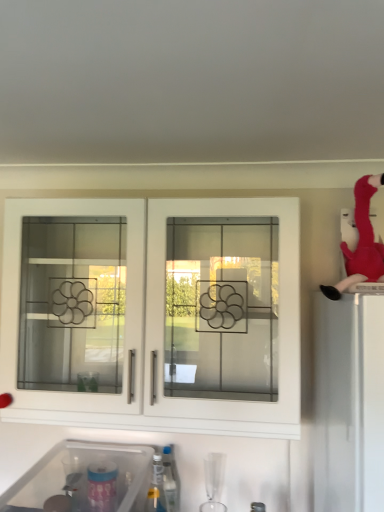
Describe the element at coordinates (156, 487) in the screenshot. I see `translucent plastic bottle at lower center` at that location.

Locate an element on the screen. Image resolution: width=384 pixels, height=512 pixels. translucent plastic bottle at lower center is located at coordinates (156, 487).

In order to face velvet plush flamingo at upper right, should I rotate leftwards or rightwards?

To face it directly, rotate right by 21.558 degrees.

Find the location of a particular element. This screenshot has width=384, height=512. transparent plastic sink at lower left is located at coordinates (83, 479).

Considering their positions, is translucent plastic bottle at lower center located in front of or behind velvet plush flamingo at upper right?

translucent plastic bottle at lower center is behind velvet plush flamingo at upper right.

Which of these two, translucent plastic bottle at lower center or velvet plush flamingo at upper right, is thinner?

translucent plastic bottle at lower center.

Do you think translucent plastic bottle at lower center is within velvet plush flamingo at upper right, or outside of it?

The correct answer is: outside.

From the image's perspective, is translucent plastic bottle at lower center located beneath velvet plush flamingo at upper right?

Yes, from the image's perspective, translucent plastic bottle at lower center is beneath velvet plush flamingo at upper right.

From a real-world perspective, which object rests below the other?

translucent plastic bottle at lower center is physically lower.

From the image's perspective, is transparent plastic sink at lower left below translucent plastic bottle at lower center?

Incorrect, from the image's perspective, transparent plastic sink at lower left is higher than translucent plastic bottle at lower center.

Where is `sink on the left of translucent plastic bottle at lower center`? This screenshot has height=512, width=384. sink on the left of translucent plastic bottle at lower center is located at coordinates (83, 479).

Is transparent plastic sink at lower left not within translucent plastic bottle at lower center?

That's correct, transparent plastic sink at lower left is outside of translucent plastic bottle at lower center.

From the image's perspective, who appears lower, transparent plastic sink at lower left or white glass cabinet doors at center?

transparent plastic sink at lower left, from the image's perspective.

Which is in front, point (24, 500) or point (224, 418)?

Positioned in front is point (224, 418).

Where is `sink that is under the white glass cabinet doors at center (from a real-world perspective)`? This screenshot has width=384, height=512. sink that is under the white glass cabinet doors at center (from a real-world perspective) is located at coordinates (83, 479).

From a real-world perspective, which is physically below, transparent plastic sink at lower left or white glass cabinet doors at center?

From a 3D spatial view, transparent plastic sink at lower left is below.

The width and height of the screenshot is (384, 512). Find the location of `person on the right of white glass cabinet doors at center`. person on the right of white glass cabinet doors at center is located at coordinates (361, 243).

How distant is velvet plush flamingo at upper right from white glass cabinet doors at center?

They are 18.03 inches apart.

Is velvet plush flamingo at upper right aimed at white glass cabinet doors at center?

No, velvet plush flamingo at upper right is not oriented towards white glass cabinet doors at center.

Which point is more forward, (147, 497) or (8, 367)?

Positioned in front is point (147, 497).

Consider the image. Can you confirm if translucent plastic bottle at lower center is smaller than white glass cabinet doors at center?

Yes, translucent plastic bottle at lower center is smaller than white glass cabinet doors at center.

Looking at this image, considering the sizes of translucent plastic bottle at lower center and white glass cabinet doors at center in the image, is translucent plastic bottle at lower center taller or shorter than white glass cabinet doors at center?

In the image, translucent plastic bottle at lower center appears to be shorter than white glass cabinet doors at center.

Is translucent plastic bottle at lower center thinner than white glass cabinet doors at center?

Indeed, translucent plastic bottle at lower center has a lesser width compared to white glass cabinet doors at center.

Between point (147, 366) and point (365, 226), which one is positioned behind?

Positioned behind is point (147, 366).

In the scene shown: Does white glass cabinet doors at center touch velvet plush flamingo at upper right?

They are not placed beside each other.

Between white glass cabinet doors at center and velvet plush flamingo at upper right, which one has smaller width?

Thinner between the two is velvet plush flamingo at upper right.

From the image's perspective, which one is positioned higher, white glass cabinet doors at center or velvet plush flamingo at upper right?

velvet plush flamingo at upper right.

Is velvet plush flamingo at upper right facing away from transparent plastic sink at lower left?

No, velvet plush flamingo at upper right is not facing the opposite direction of transparent plastic sink at lower left.

Which object is closer to the camera, velvet plush flamingo at upper right or transparent plastic sink at lower left?

transparent plastic sink at lower left is more forward.

Looking at this image, do you think velvet plush flamingo at upper right is within transparent plastic sink at lower left, or outside of it?

velvet plush flamingo at upper right lies outside transparent plastic sink at lower left.

Can you confirm if velvet plush flamingo at upper right is positioned to the right of transparent plastic sink at lower left?

Correct, you'll find velvet plush flamingo at upper right to the right of transparent plastic sink at lower left.

At what (x,y) coordinates should I click in order to perform the action: click on bottle located behind the velvet plush flamingo at upper right. Please return your answer as a coordinate pair (x, y). Looking at the image, I should click on click(156, 487).

This screenshot has width=384, height=512. In order to click on sink on the left of translucent plastic bottle at lower center in this screenshot , I will do `click(83, 479)`.

Estimate the real-world distances between objects in this image. Which object is further from transparent plastic sink at lower left, translucent plastic bottle at lower center or velvet plush flamingo at upper right?

velvet plush flamingo at upper right.

Estimate the real-world distances between objects in this image. Which object is further from transparent plastic sink at lower left, white glass cabinet doors at center or translucent plastic bottle at lower center?

The object further to transparent plastic sink at lower left is white glass cabinet doors at center.

Estimate the real-world distances between objects in this image. Which object is further from white glass cabinet doors at center, velvet plush flamingo at upper right or transparent plastic sink at lower left?

velvet plush flamingo at upper right lies further to white glass cabinet doors at center than the other object.

From the image, which object appears to be farther from velvet plush flamingo at upper right, translucent plastic bottle at lower center or transparent plastic sink at lower left?

transparent plastic sink at lower left is further to velvet plush flamingo at upper right.

Estimate the real-world distances between objects in this image. Which object is further from white glass cabinet doors at center, transparent plastic sink at lower left or translucent plastic bottle at lower center?

The object further to white glass cabinet doors at center is translucent plastic bottle at lower center.

From the image, which object appears to be farther from translucent plastic bottle at lower center, transparent plastic sink at lower left or white glass cabinet doors at center?

A: white glass cabinet doors at center lies further to translucent plastic bottle at lower center than the other object.

Estimate the real-world distances between objects in this image. Which object is closer to translucent plastic bottle at lower center, velvet plush flamingo at upper right or white glass cabinet doors at center?

Among the two, white glass cabinet doors at center is located nearer to translucent plastic bottle at lower center.

From the image, which object appears to be nearer to velvet plush flamingo at upper right, transparent plastic sink at lower left or white glass cabinet doors at center?

Based on the image, white glass cabinet doors at center appears to be nearer to velvet plush flamingo at upper right.

The image size is (384, 512). In order to click on cabinetry between velvet plush flamingo at upper right and transparent plastic sink at lower left from top to bottom in this screenshot , I will do pos(157,325).

Identify the location of cabinetry between velvet plush flamingo at upper right and translucent plastic bottle at lower center in the up-down direction. (157, 325).

Locate an element on the screen. This screenshot has width=384, height=512. sink that lies between velvet plush flamingo at upper right and translucent plastic bottle at lower center from top to bottom is located at coordinates (83, 479).

Image resolution: width=384 pixels, height=512 pixels. I want to click on sink between white glass cabinet doors at center and translucent plastic bottle at lower center vertically, so click(83, 479).